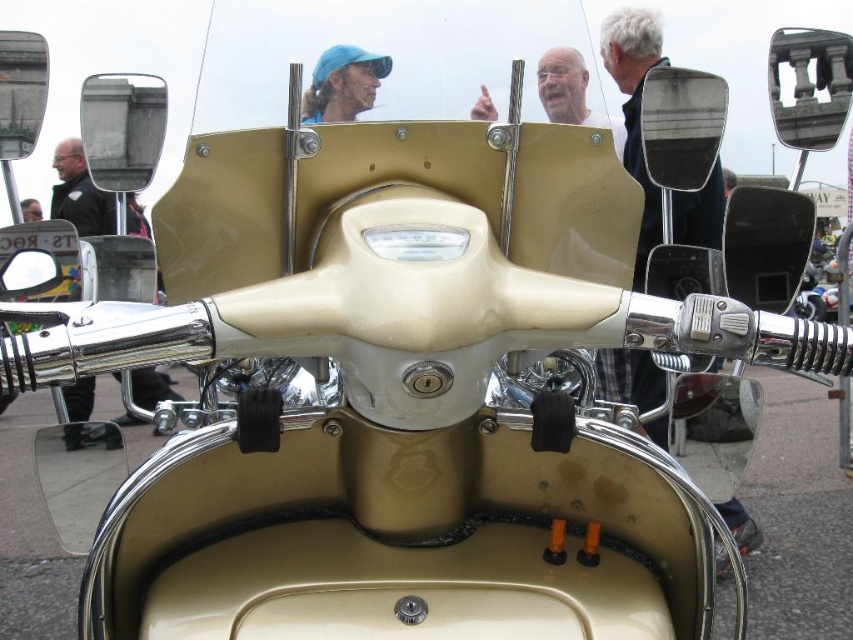
You are a rider preparing to mount the smooth beige scooter at center. You notice a matte blue cap at upper center nearby. Can you tell me which object is smaller in size between them?

The matte blue cap at upper center has a smaller size compared to the smooth beige scooter at center, so the matte blue cap at upper center is smaller.

You are a rider preparing to mount the vintage scooter. You notice two items on the handlebars. Which item is smaller between the matte blue cap at upper center and the matte black helmet at upper left?

The matte blue cap at upper center is smaller than the matte black helmet at upper left.